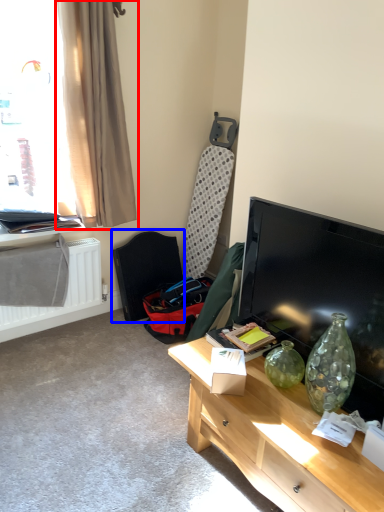
Question: Which point is further to the camera, curtain (highlighted by a red box) or swivel chair (highlighted by a blue box)?

Choices:
 (A) curtain
 (B) swivel chair

Answer: (B)